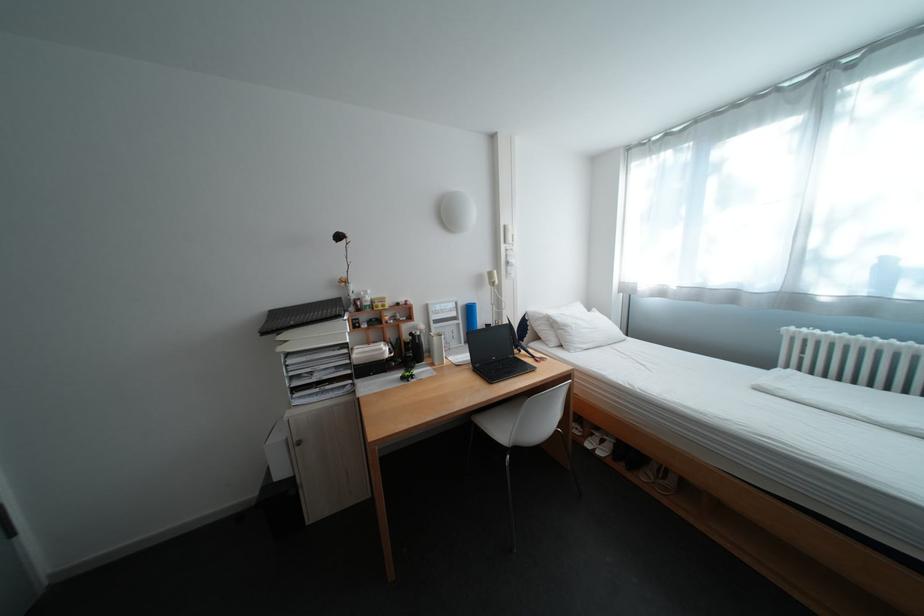
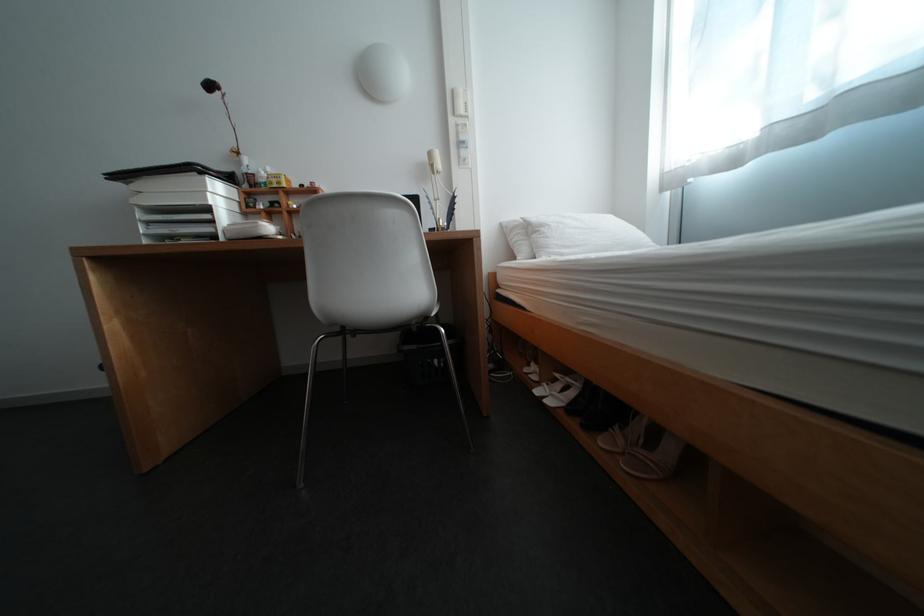
Locate, in the second image, the point that corresponds to (517,228) in the first image.

(466, 92)